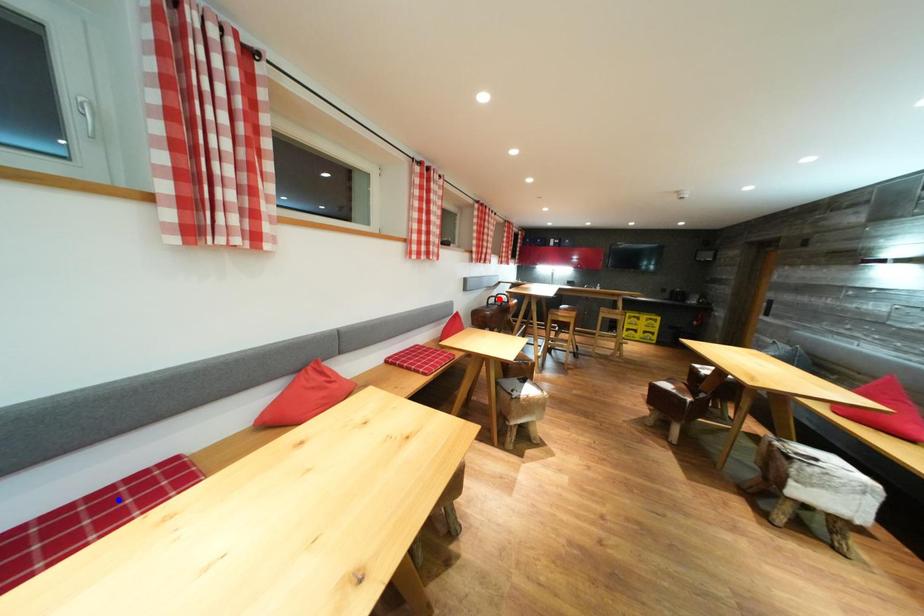
Question: In the image, two points are highlighted. Which point is nearer to the camera? Reply with the corresponding letter.

Choices:
 (A) blue point
 (B) red point

Answer: (A)